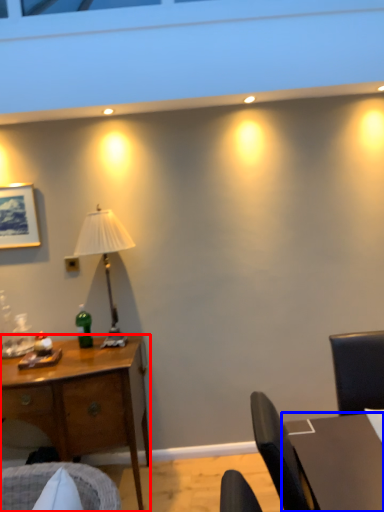
Question: Which of the following is the farthest to the observer, desk (highlighted by a red box) or table (highlighted by a blue box)?

Choices:
 (A) desk
 (B) table

Answer: (A)